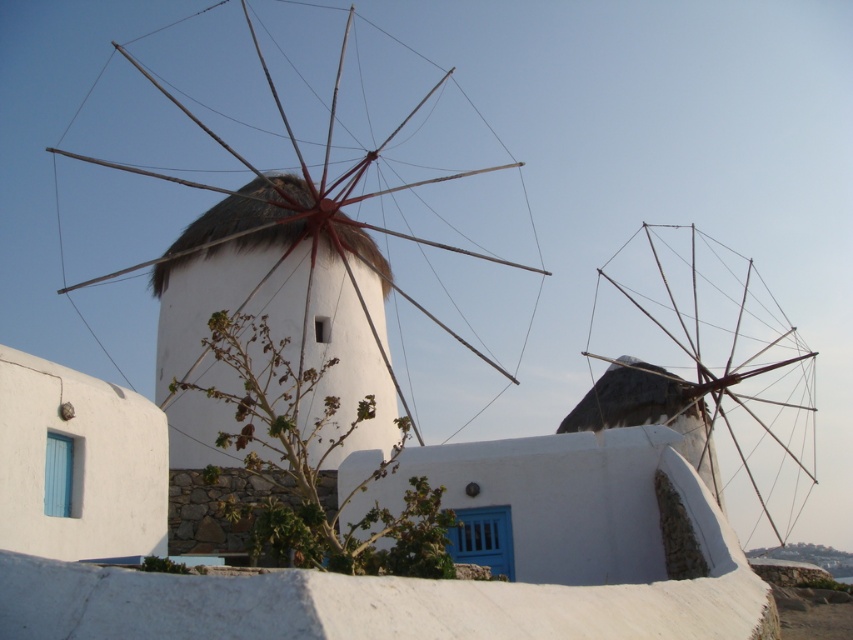
Is white thatched roof windmill at center further to the viewer compared to wooden windmill at center?

No, white thatched roof windmill at center is closer to the viewer.

Which is behind, point (308, 205) or point (674, 336)?

Point (674, 336)

Is point (288, 330) more distant than point (718, 253)?

No, (288, 330) is in front of (718, 253).

You are a GUI agent. You are given a task and a screenshot of the screen. Output one action in this format:
    pyautogui.click(x=<x>, y=<y>)
    Task: Click on the white thatched roof windmill at center
    Image resolution: width=853 pixels, height=640 pixels.
    Given the screenshot: What is the action you would take?
    pyautogui.click(x=282, y=285)